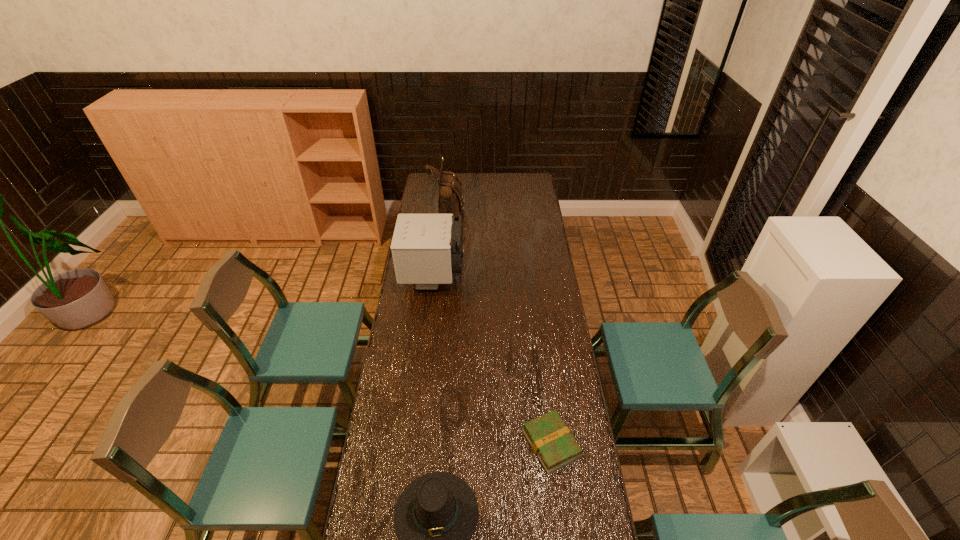
In order to click on vacant space at the far edge of the desktop in this screenshot , I will do `click(461, 184)`.

In the image, there is a desktop. Where is `vacant space at the left edge`? The height and width of the screenshot is (540, 960). vacant space at the left edge is located at coordinates (369, 459).

The image size is (960, 540). What are the coordinates of `free space at the right edge of the desktop` in the screenshot? It's located at (546, 224).

In the image, there is a desktop. Identify the location of vacant space at the far right corner. This screenshot has height=540, width=960. (519, 187).

Find the location of `free space between the shoulder bag and the rightmost object`. free space between the shoulder bag and the rightmost object is located at coordinates (500, 326).

Identify the location of vacant area between the book and the third nearest object. (492, 362).

Locate an element on the screen. object that stands as the second closest to the fan is located at coordinates (551, 440).

Identify which object is the second nearest to the second shortest object. Please provide its 2D coordinates. Your answer should be formatted as a tuple, i.e. [(x, y)], where the tuple contains the x and y coordinates of a point satisfying the conditions above.

[(427, 249)]

The width and height of the screenshot is (960, 540). Find the location of `free space that satisfies the following two spatial constraints: 1. on the back side of the book; 2. on the front-facing side of the farthest object`. free space that satisfies the following two spatial constraints: 1. on the back side of the book; 2. on the front-facing side of the farthest object is located at coordinates (522, 208).

Locate an element on the screen. Image resolution: width=960 pixels, height=540 pixels. free space that satisfies the following two spatial constraints: 1. on the front-facing side of the farthest object; 2. on the right side of the book is located at coordinates (427, 443).